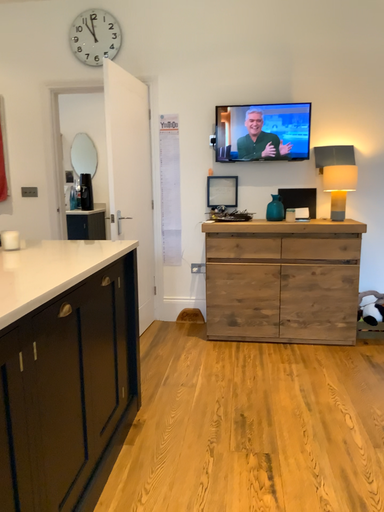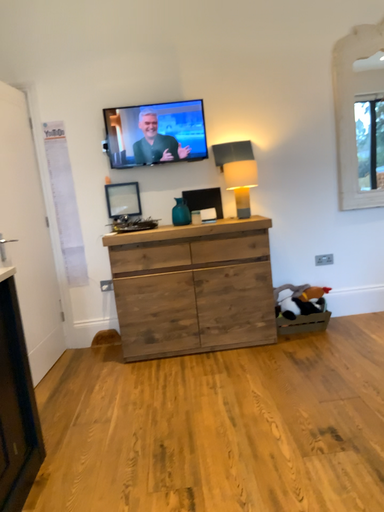
Question: How did the camera likely rotate when shooting the video?

Choices:
 (A) rotated right
 (B) rotated left

Answer: (A)